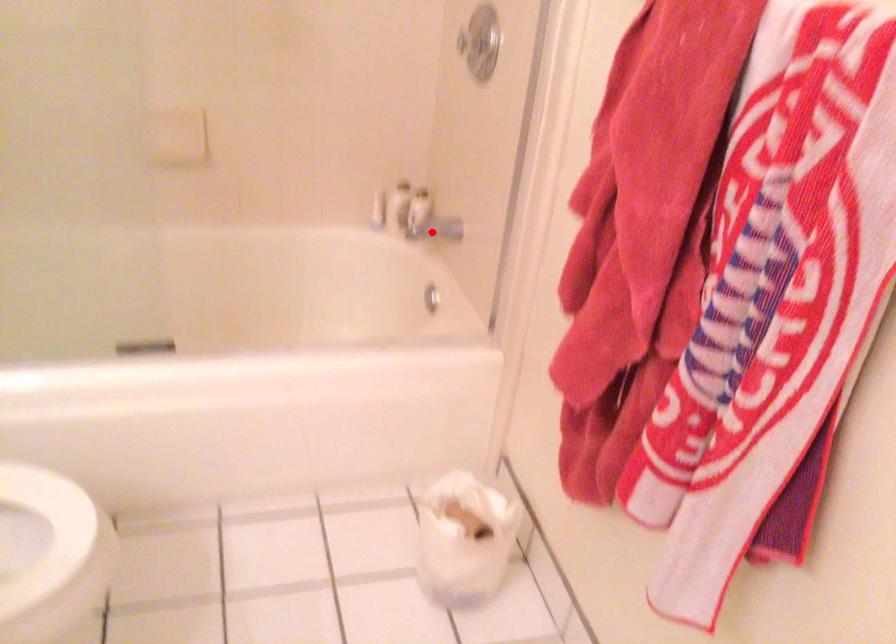
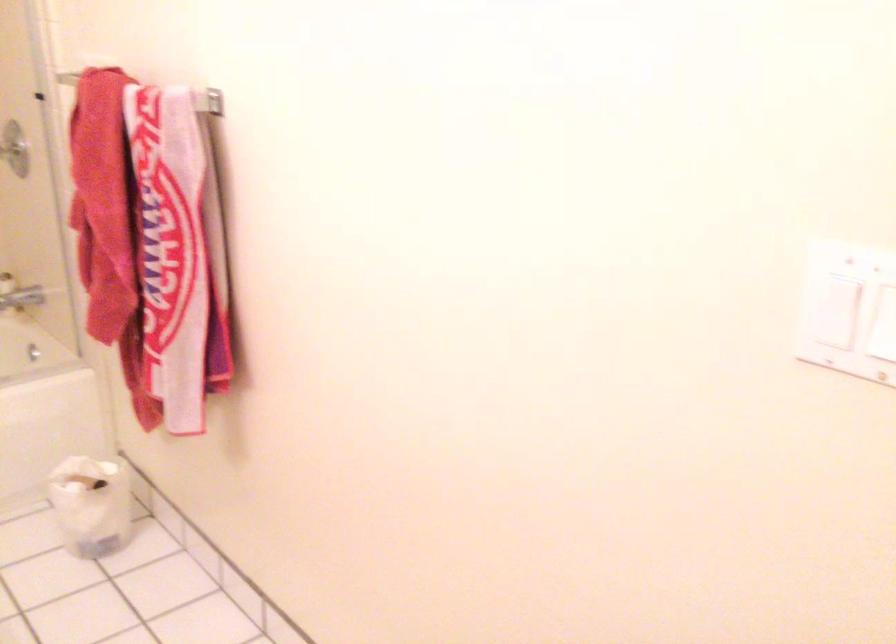
Question: I am providing you with two images of the same scene from different viewpoints. Given a red point in image1, look at the same physical point in image2. Is it:

Choices:
 (A) Closer to the viewpoint
 (B) Farther from the viewpoint

Answer: (B)